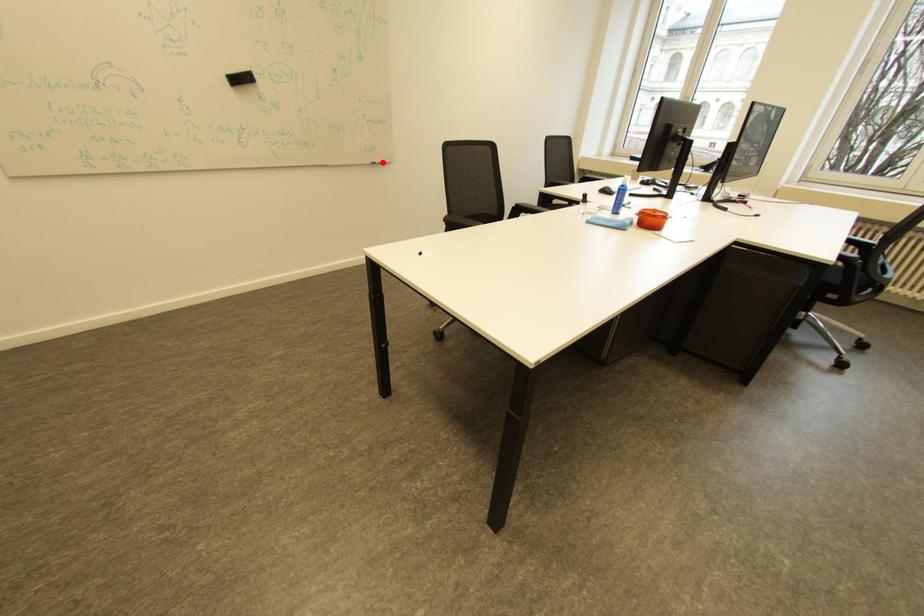
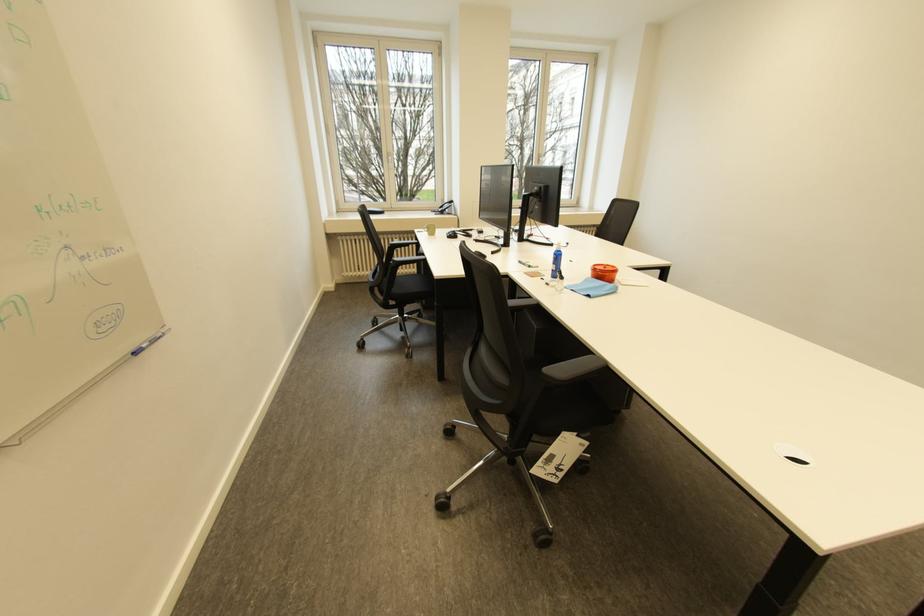
In the second image, find the point that corresponds to the highlighted location in the first image.

(141, 350)